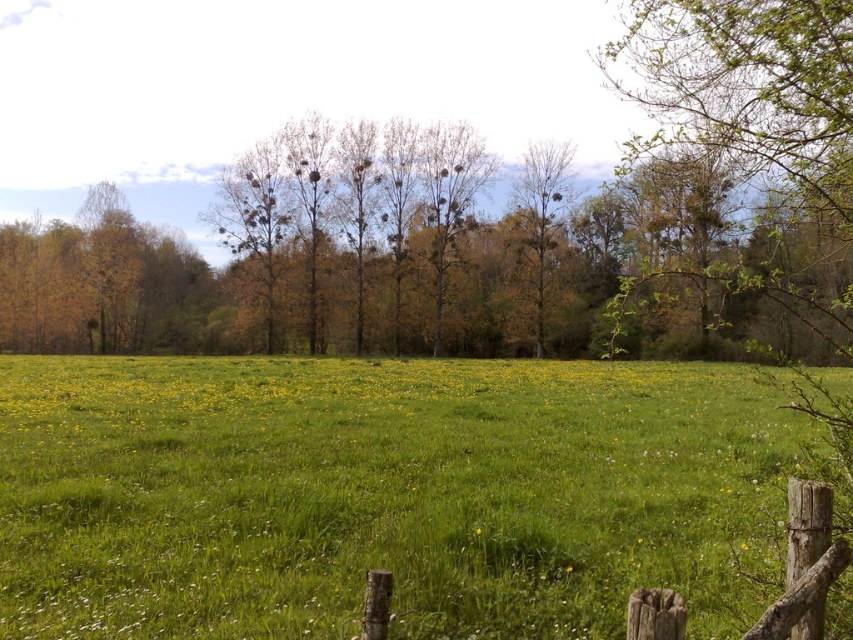
You are standing at the point labeled as point (379, 493) in the image. What type of terrain are you currently standing on?

The point labeled as point (379, 493) is located on the green grassy pasture at center, so you are standing on a grassy terrain.

You are standing in the middle of the green grassy pasture at center and want to look up at the green leafy tree at center. Which direction should you look to see the tree?

You should look upward because the green grassy pasture at center is located below the green leafy tree at center, so the tree is above the pasture.